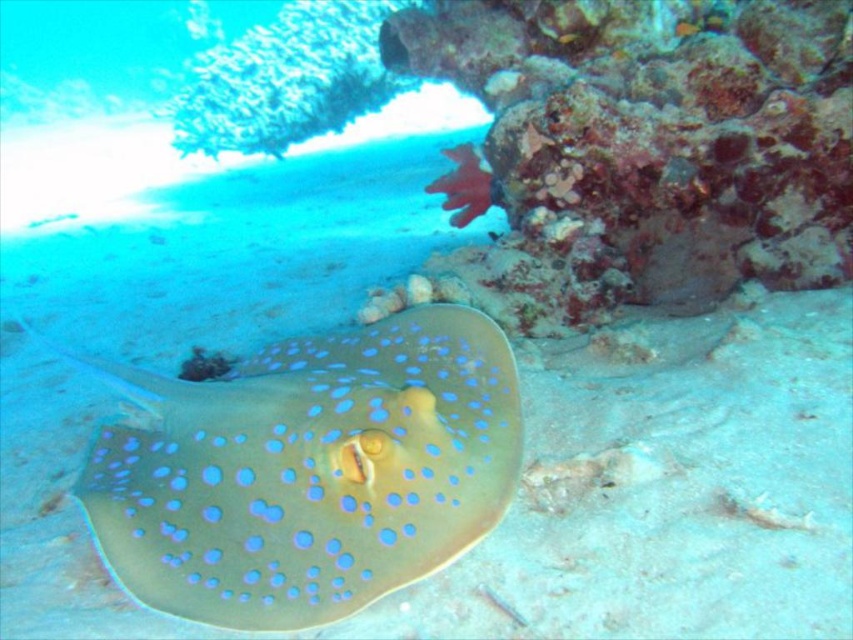
Question: Which object appears closest to the camera in this image?

Choices:
 (A) blue glossy stingray at center
 (B) rusty coral reef at upper right

Answer: (A)

Question: Which point is closer to the camera?

Choices:
 (A) (685, 157)
 (B) (459, 506)

Answer: (B)

Question: Does rusty coral reef at upper right appear over blue glossy stingray at center?

Choices:
 (A) yes
 (B) no

Answer: (A)

Question: Is rusty coral reef at upper right to the left of blue glossy stingray at center from the viewer's perspective?

Choices:
 (A) no
 (B) yes

Answer: (A)

Question: Is rusty coral reef at upper right to the left of blue glossy stingray at center from the viewer's perspective?

Choices:
 (A) yes
 (B) no

Answer: (B)